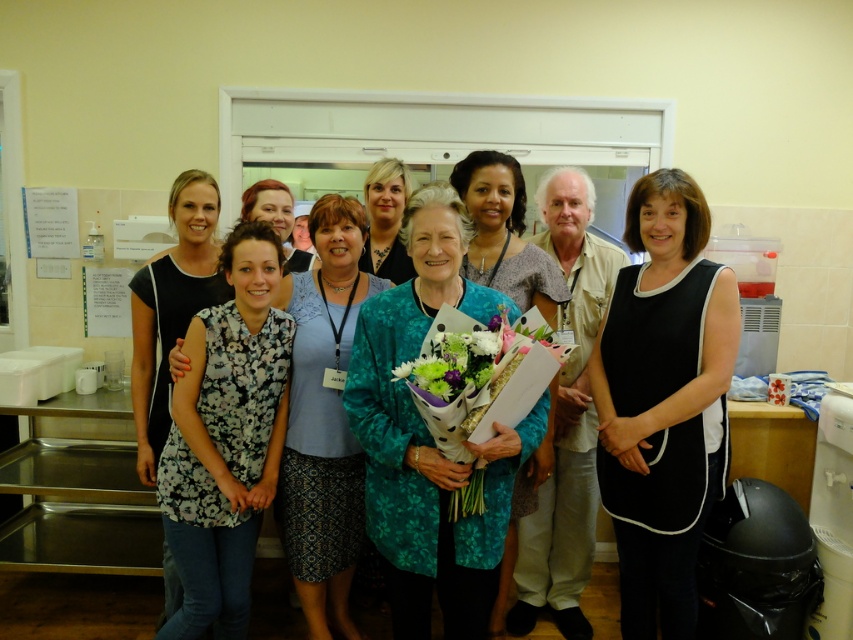
You are a photographer trying to adjust the lighting for a group photo. You need to ensure that the khaki cotton shirt at center and the matte floral dress at center are both well lit. Since one is in front of the other, which one might need additional lighting to ensure it isn not overshadowed?

The matte floral dress at center might need additional lighting because the khaki cotton shirt at center is in front of it, potentially blocking some light from reaching the dress.

Based on the scene description, where is the black satin dress at center located in terms of coordinates?

The black satin dress at center is located at coordinates point (x=663, y=401).